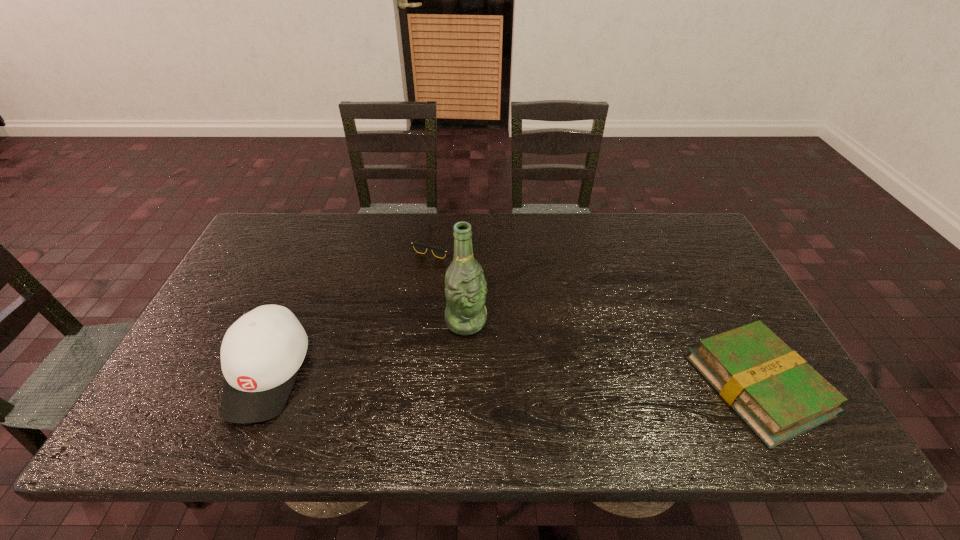
The width and height of the screenshot is (960, 540). In order to click on vacant space on the desktop that is between the third shortest object and the book and is positioned on the surface of the tallest object in this screenshot , I will do (x=516, y=380).

Where is `free spot on the desktop that is between the baseball cap and the book and is positioned on the lenses of the sunglasses`? The height and width of the screenshot is (540, 960). free spot on the desktop that is between the baseball cap and the book and is positioned on the lenses of the sunglasses is located at coordinates (448, 378).